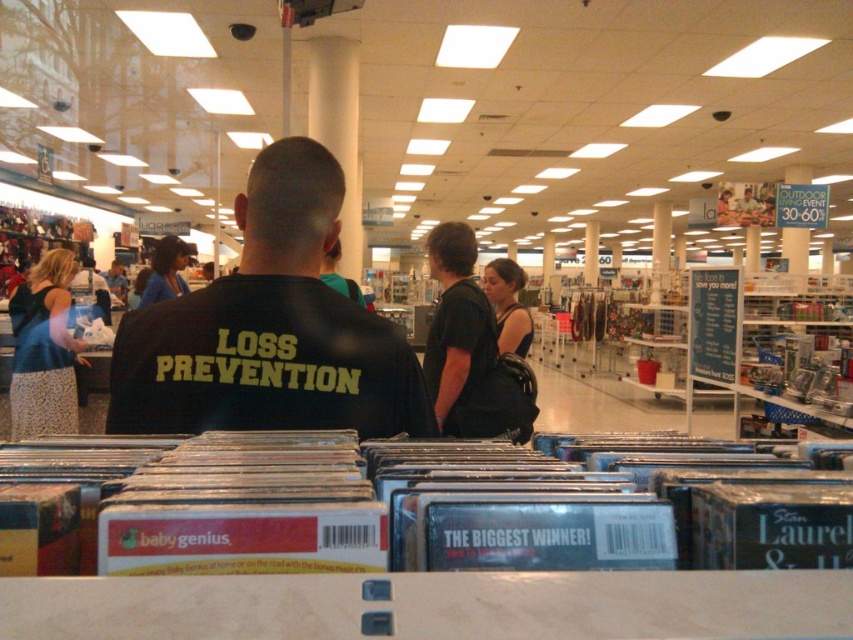
Question: Which point is farther from the camera taking this photo?

Choices:
 (A) (454, 362)
 (B) (404, 417)

Answer: (A)

Question: Which object is closer to the camera taking this photo?

Choices:
 (A) black leather handbag at center
 (B) black fabric shirt at center

Answer: (B)

Question: Is black fabric shirt at center behind black leather handbag at center?

Choices:
 (A) no
 (B) yes

Answer: (A)

Question: Which object appears closest to the camera in this image?

Choices:
 (A) black fabric shirt at center
 (B) black leather handbag at center

Answer: (A)

Question: Is black fabric shirt at center above black leather handbag at center?

Choices:
 (A) no
 (B) yes

Answer: (B)

Question: Can you confirm if black fabric shirt at center is positioned to the left of black leather handbag at center?

Choices:
 (A) no
 (B) yes

Answer: (B)